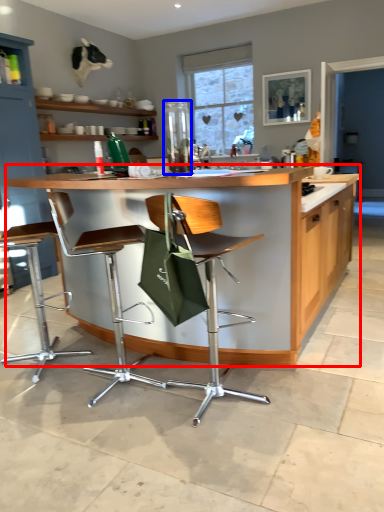
Question: Which point is further to the camera, countertop (highlighted by a red box) or appliance (highlighted by a blue box)?

Choices:
 (A) countertop
 (B) appliance

Answer: (B)